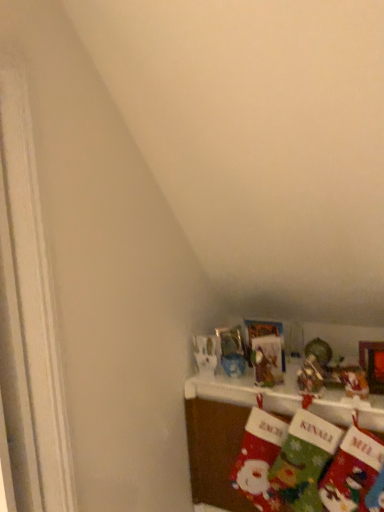
Where is `free space behind metallic silver ornament at upper center, the 2th toy from the right`? free space behind metallic silver ornament at upper center, the 2th toy from the right is located at coordinates (296, 377).